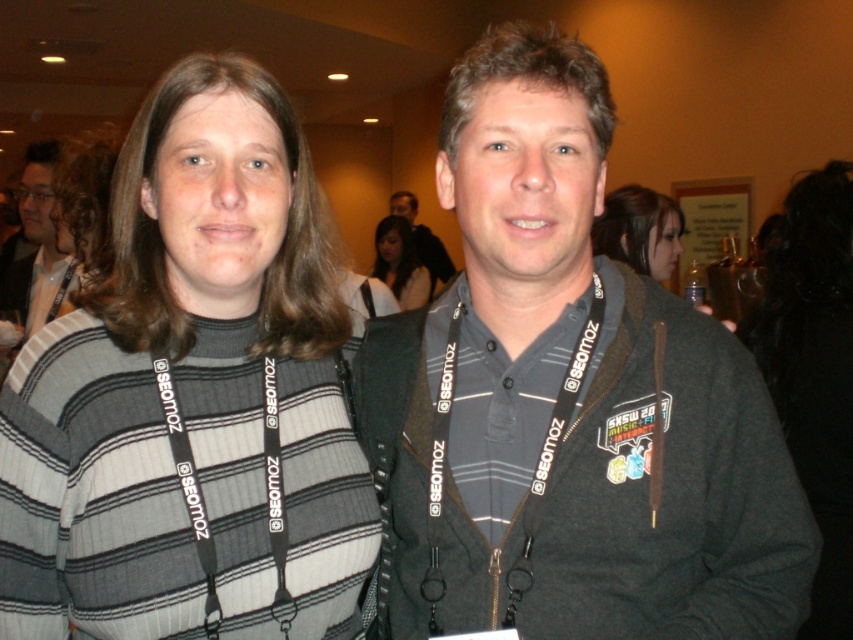
You are at a social event and want to take a photo of the black hair at upper right and the gray fabric shirt at center. Which object is closer to the camera?

The black hair at upper right is positioned under the gray fabric shirt at center, so the gray fabric shirt at center is closer to the camera because objects above are typically closer in such compositions.

From the picture: You are at a networking event and need to introduce yourself to both the person with black hair at upper right and the person with matte black hair at center. Which person should you approach first if you want to start with the one closer to your current position?

The matte black hair at center is closer to your current position because the black hair at upper right is positioned to the right of it, meaning the matte black hair at center is nearer to you.

You are at a social event and want to take a photo of the striped sweater at center and the black hair at upper right. Which object is closer to the camera?

The striped sweater at center is shorter than black hair at upper right, so the black hair at upper right is closer to the camera.